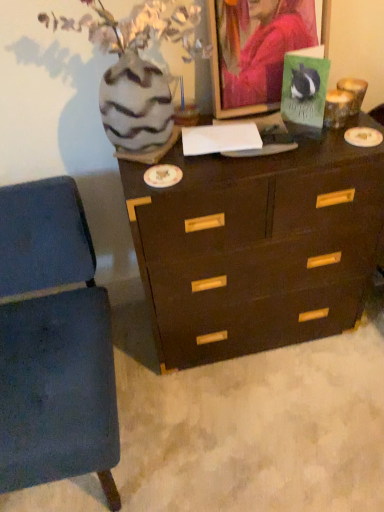
I want to click on free spot above dark wood chest of drawers at center (from a real-world perspective), so click(x=256, y=148).